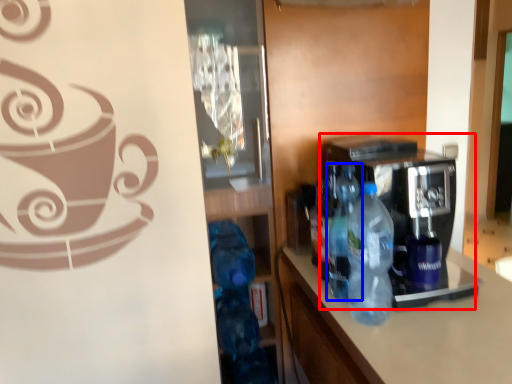
Question: Which object appears farthest to the camera in this image, coffee machine (highlighted by a red box) or bottle (highlighted by a blue box)?

Choices:
 (A) coffee machine
 (B) bottle

Answer: (B)